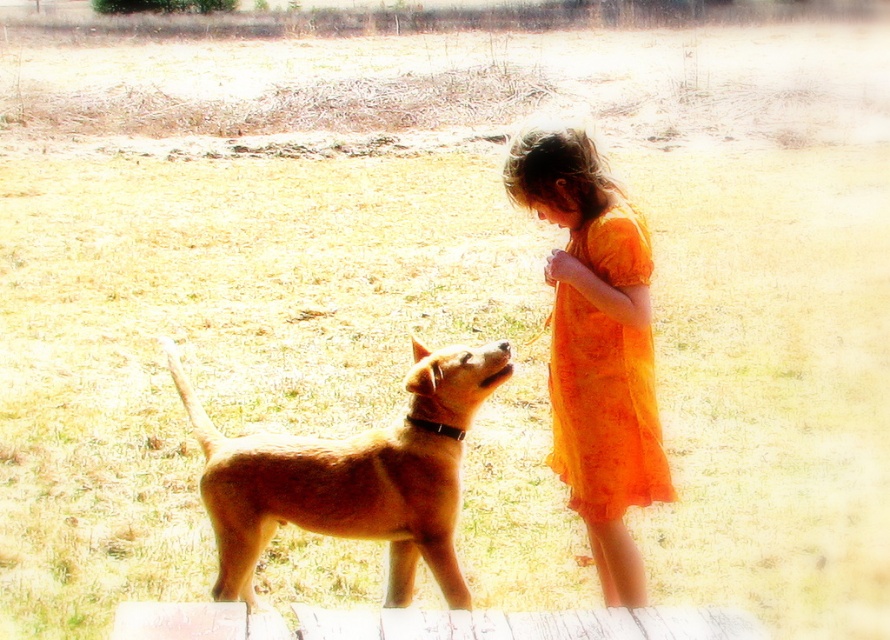
Which is above, golden fur dog at center or orange sheer dress at upper right?

Positioned higher is orange sheer dress at upper right.

Between point (290, 449) and point (600, 220), which one is positioned in front?

Point (600, 220)

Is point (430, 538) farther from viewer compared to point (637, 401)?

That is True.

Identify the location of golden fur dog at center. (352, 476).

Describe the element at coordinates (596, 348) in the screenshot. I see `orange sheer dress at center` at that location.

Is orange sheer dress at center positioned in front of orange sheer dress at upper right?

No, it is behind orange sheer dress at upper right.

Between point (573, 484) and point (608, 376), which one is positioned in front?

Point (608, 376)

Where is `orange sheer dress at center`? The width and height of the screenshot is (890, 640). orange sheer dress at center is located at coordinates (596, 348).

Can you confirm if orange sheer dress at center is bigger than golden fur dog at center?

Actually, orange sheer dress at center might be smaller than golden fur dog at center.

Is the position of orange sheer dress at center more distant than that of golden fur dog at center?

No, it is not.

Which is behind, point (587, 422) or point (435, 464)?

Positioned behind is point (435, 464).

At what (x,y) coordinates should I click in order to perform the action: click on orange sheer dress at center. Please return your answer as a coordinate pair (x, y). Image resolution: width=890 pixels, height=640 pixels. Looking at the image, I should click on (596, 348).